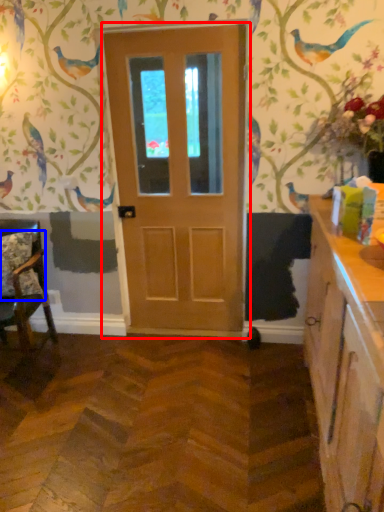
Question: Which object is further to the camera taking this photo, door (highlighted by a red box) or pillow (highlighted by a blue box)?

Choices:
 (A) door
 (B) pillow

Answer: (B)